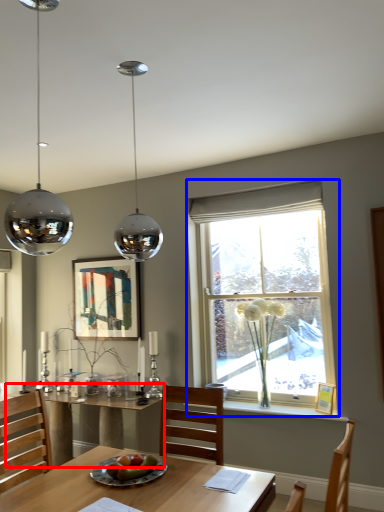
Question: Which of the following is the closest to the observer, table (highlighted by a red box) or window (highlighted by a blue box)?

Choices:
 (A) table
 (B) window

Answer: (A)